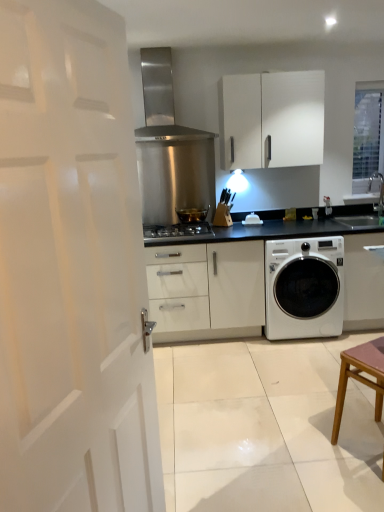
Question: Is the depth of white glossy sink at upper right less than that of stainless steel range hood at upper center?

Choices:
 (A) yes
 (B) no

Answer: (B)

Question: From the image's perspective, would you say white glossy sink at upper right is positioned over stainless steel range hood at upper center?

Choices:
 (A) no
 (B) yes

Answer: (A)

Question: Would you consider white glossy sink at upper right to be distant from stainless steel range hood at upper center?

Choices:
 (A) no
 (B) yes

Answer: (B)

Question: Is white glossy sink at upper right behind stainless steel range hood at upper center?

Choices:
 (A) no
 (B) yes

Answer: (B)

Question: Is white glossy sink at upper right positioned with its back to stainless steel range hood at upper center?

Choices:
 (A) no
 (B) yes

Answer: (A)

Question: From a real-world perspective, is stainless steel gas stove at center physically located above or below white glossy sink at upper right?

Choices:
 (A) above
 (B) below

Answer: (B)

Question: From the image's perspective, relative to white glossy sink at upper right, is stainless steel gas stove at center above or below?

Choices:
 (A) below
 (B) above

Answer: (A)

Question: Based on their positions, is stainless steel gas stove at center located to the left or right of white glossy sink at upper right?

Choices:
 (A) right
 (B) left

Answer: (B)

Question: Is point (150, 232) closer or farther from the camera than point (382, 223)?

Choices:
 (A) closer
 (B) farther

Answer: (B)

Question: Is point (281, 249) positioned closer to the camera than point (372, 362)?

Choices:
 (A) farther
 (B) closer

Answer: (A)

Question: Do you think white glossy washing machine at lower right is within brown wooden table at lower right, or outside of it?

Choices:
 (A) inside
 (B) outside

Answer: (B)

Question: Considering the positions of white glossy washing machine at lower right and brown wooden table at lower right in the image, is white glossy washing machine at lower right taller or shorter than brown wooden table at lower right?

Choices:
 (A) tall
 (B) short

Answer: (A)

Question: In terms of size, does white glossy washing machine at lower right appear bigger or smaller than brown wooden table at lower right?

Choices:
 (A) small
 (B) big

Answer: (B)

Question: In the image, is white glossy washing machine at lower right positioned in front of or behind white glossy sink at upper right?

Choices:
 (A) behind
 (B) front

Answer: (B)

Question: Is point (281, 269) positioned closer to the camera than point (377, 221)?

Choices:
 (A) farther
 (B) closer

Answer: (B)